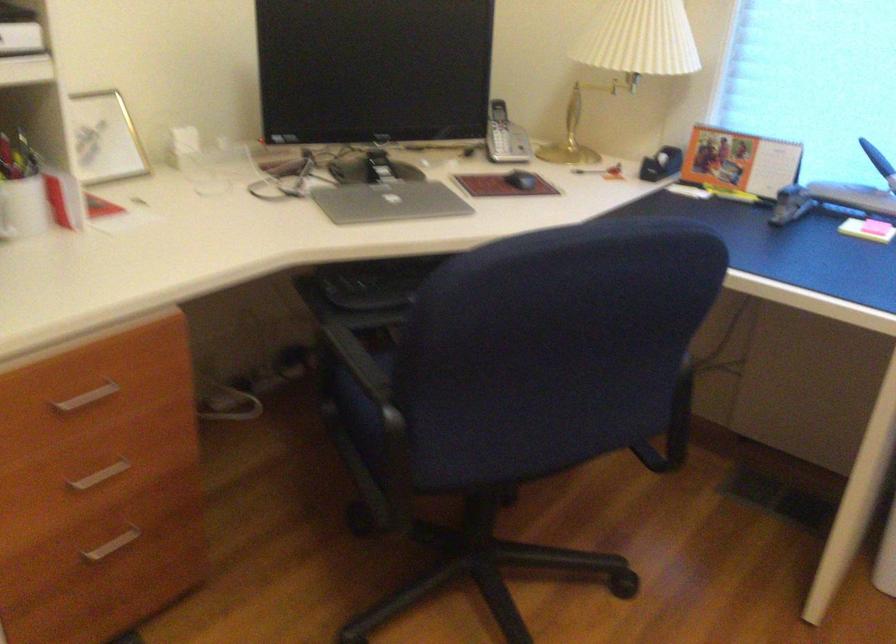
Where would you pull the black tape dispenser? Please return your answer as a coordinate pair (x, y).

(660, 164)